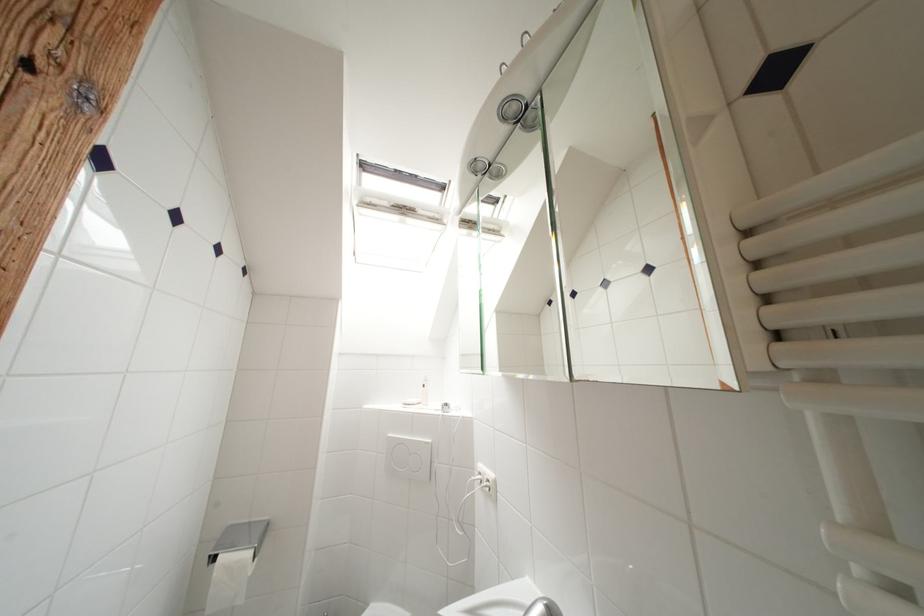
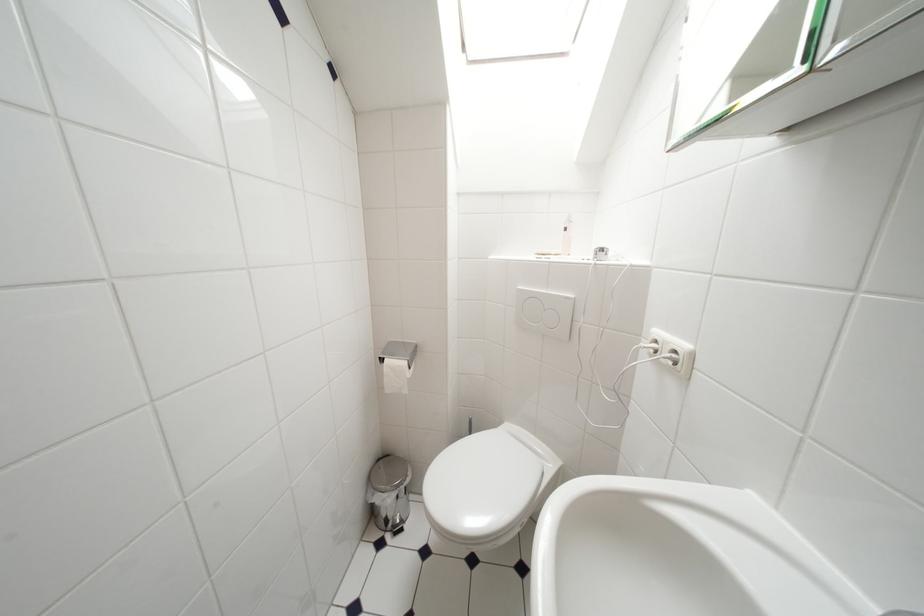
From the picture: How did the camera likely rotate?

The camera's rotation is toward left-down.